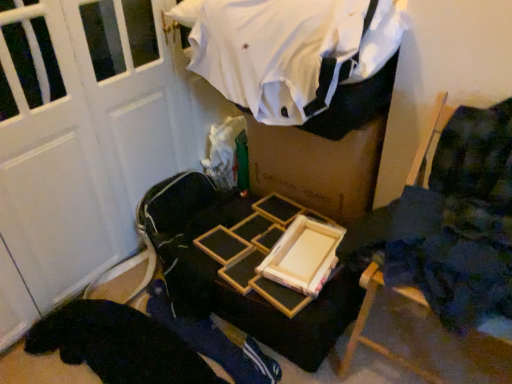
Question: From a real-world perspective, is blue fabric at center located higher than white cotton shirt at upper center?

Choices:
 (A) no
 (B) yes

Answer: (A)

Question: From a real-world perspective, is blue fabric at center located beneath white cotton shirt at upper center?

Choices:
 (A) no
 (B) yes

Answer: (B)

Question: Does blue fabric at center come in front of white cotton shirt at upper center?

Choices:
 (A) yes
 (B) no

Answer: (B)

Question: Can you confirm if blue fabric at center is wider than white cotton shirt at upper center?

Choices:
 (A) yes
 (B) no

Answer: (A)

Question: Would you say blue fabric at center contains white cotton shirt at upper center?

Choices:
 (A) yes
 (B) no

Answer: (B)

Question: Does blue fabric at center have a lesser width compared to white cotton shirt at upper center?

Choices:
 (A) no
 (B) yes

Answer: (A)

Question: Is blue fabric at center facing towards wooden chair at right?

Choices:
 (A) no
 (B) yes

Answer: (A)

Question: Is wooden chair at right inside blue fabric at center?

Choices:
 (A) no
 (B) yes

Answer: (A)

Question: Is blue fabric at center thinner than wooden chair at right?

Choices:
 (A) no
 (B) yes

Answer: (A)

Question: From the image's perspective, is blue fabric at center on top of wooden chair at right?

Choices:
 (A) no
 (B) yes

Answer: (A)

Question: Can you confirm if blue fabric at center is positioned to the right of wooden chair at right?

Choices:
 (A) no
 (B) yes

Answer: (A)

Question: Is blue fabric at center wider than wooden chair at right?

Choices:
 (A) yes
 (B) no

Answer: (A)

Question: Considering the relative sizes of wooden frame at center and blue fabric at center in the image provided, is wooden frame at center smaller than blue fabric at center?

Choices:
 (A) no
 (B) yes

Answer: (A)